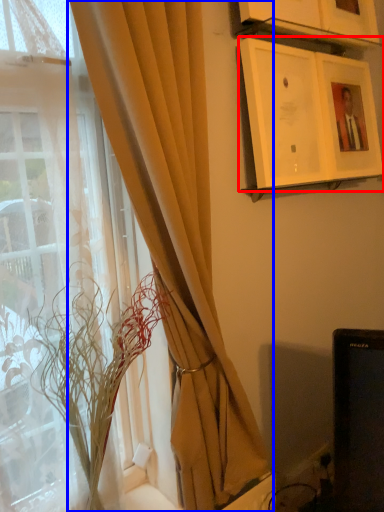
Question: Which of the following is the farthest to the observer, picture frame (highlighted by a red box) or curtain (highlighted by a blue box)?

Choices:
 (A) picture frame
 (B) curtain

Answer: (A)